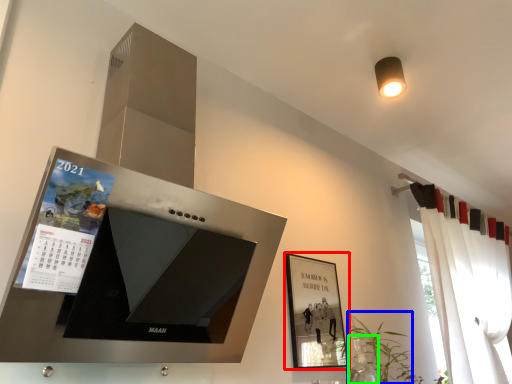
Question: Based on their relative distances, which object is farther from picture frame (highlighted by a red box)? Choose from plant (highlighted by a blue box) and glass vase (highlighted by a green box).

Choices:
 (A) plant
 (B) glass vase

Answer: (A)